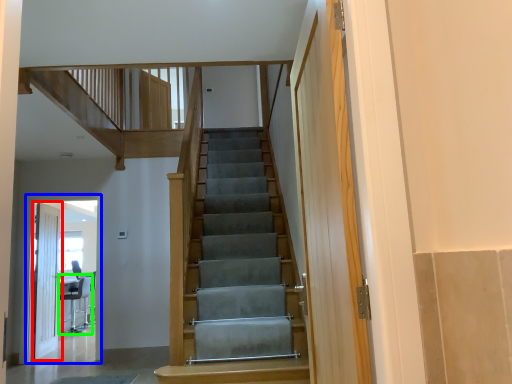
Question: Which object is the farthest from door (highlighted by a red box)? Choose among these: elevator (highlighted by a blue box) or chair (highlighted by a green box).

Choices:
 (A) elevator
 (B) chair

Answer: (B)